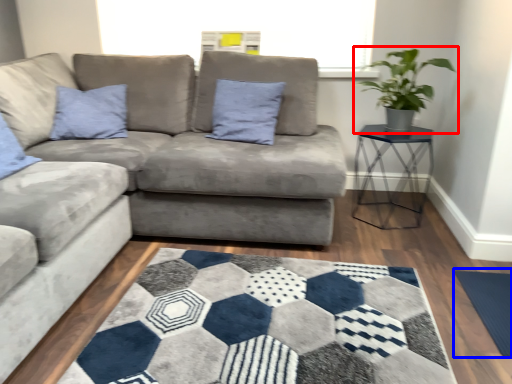
Question: Which object is closer to the camera taking this photo, houseplant (highlighted by a red box) or yoga mat (highlighted by a blue box)?

Choices:
 (A) houseplant
 (B) yoga mat

Answer: (B)